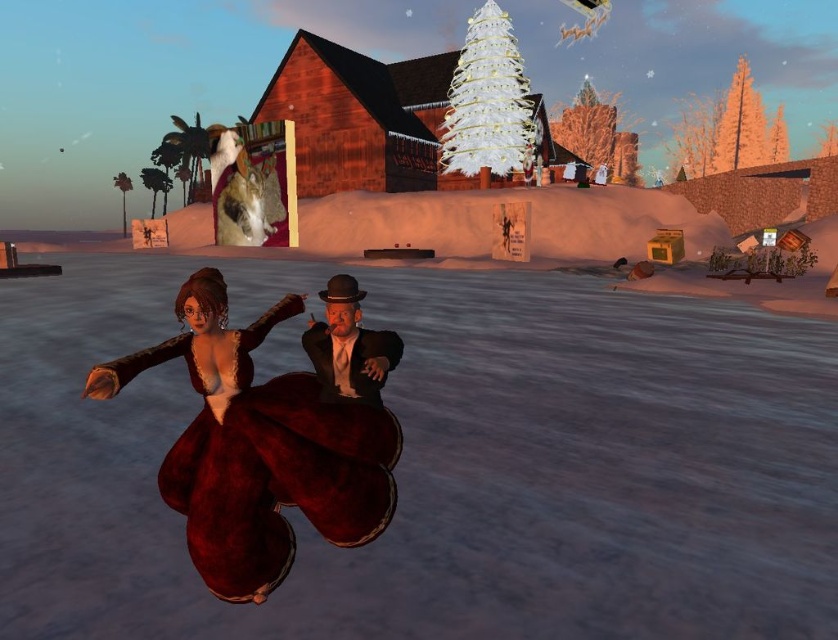
Question: Does velvet maroon dress at center have a smaller size compared to white feathered christmas tree at upper center?

Choices:
 (A) yes
 (B) no

Answer: (A)

Question: Which of the following is the closest to the observer?

Choices:
 (A) velvet maroon dress at center
 (B) shiny black suit at center

Answer: (A)

Question: Which object appears farthest from the camera in this image?

Choices:
 (A) shiny black suit at center
 (B) velvet maroon dress at center

Answer: (A)

Question: Which object is farther from the camera taking this photo?

Choices:
 (A) velvet maroon dress at center
 (B) white feathered christmas tree at upper center

Answer: (B)

Question: Can you confirm if velvet maroon dress at center is positioned to the left of shiny black suit at center?

Choices:
 (A) yes
 (B) no

Answer: (A)

Question: Can you confirm if velvet maroon dress at center is thinner than shiny black suit at center?

Choices:
 (A) yes
 (B) no

Answer: (B)